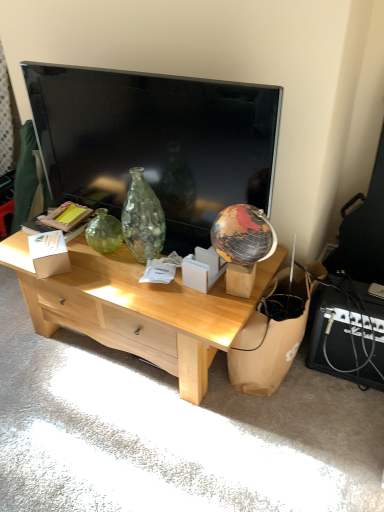
I want to click on vacant area in front of white cardboard box at center, which is the 2th cardboard box in left-to-right order, so click(x=208, y=306).